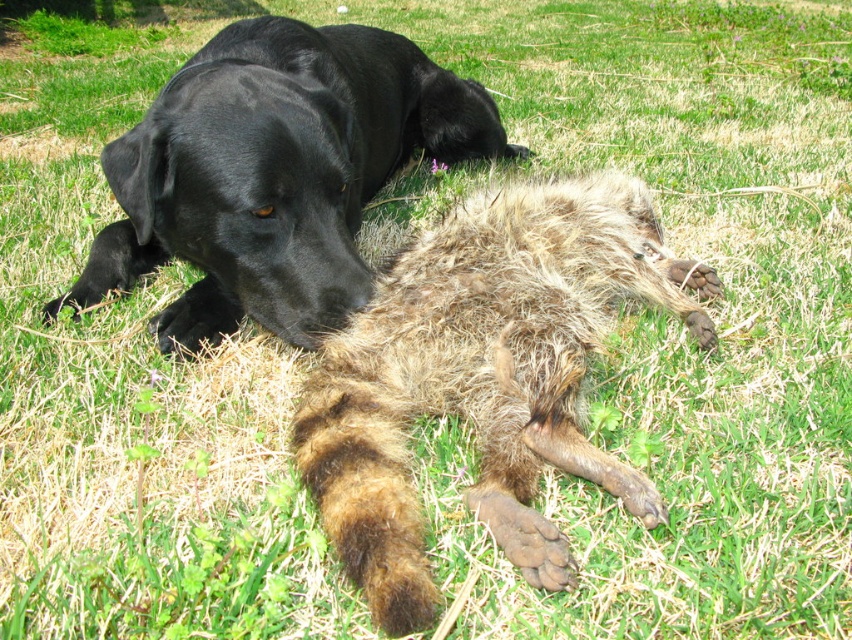
Which is in front, point (347, 522) or point (114, 234)?

Point (347, 522) is in front.

Based on the photo, between fuzzy brown fur at center and black matte dog at upper left, which one is positioned lower?

fuzzy brown fur at center is below.

Identify the location of fuzzy brown fur at center. [x=484, y=378].